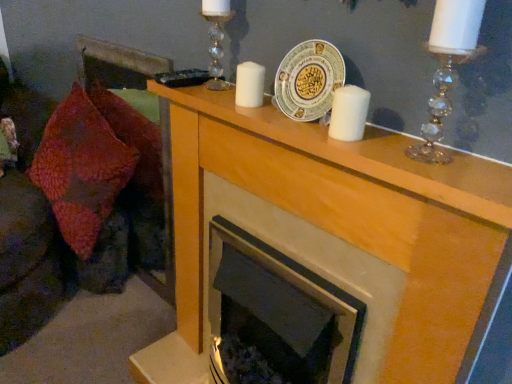
Question: Considering the relative positions of white ceramic plate at center and clear crystal candle holder at upper right, the second candle holder from the back, in the image provided, is white ceramic plate at center to the right of clear crystal candle holder at upper right, the second candle holder from the back, from the viewer's perspective?

Choices:
 (A) yes
 (B) no

Answer: (B)

Question: Does white ceramic plate at center have a lesser width compared to clear crystal candle holder at upper right, which is counted as the 1th candle holder, starting from the front?

Choices:
 (A) no
 (B) yes

Answer: (B)

Question: Can you confirm if white ceramic plate at center is bigger than clear crystal candle holder at upper right, positioned as the second candle holder in left-to-right order?

Choices:
 (A) no
 (B) yes

Answer: (A)

Question: Can clear crystal candle holder at upper right, which is the 1th candle holder in right-to-left order, be found inside white ceramic plate at center?

Choices:
 (A) no
 (B) yes

Answer: (A)

Question: Is white ceramic plate at center next to clear crystal candle holder at upper right, which is counted as the 1th candle holder, starting from the front, and touching it?

Choices:
 (A) no
 (B) yes

Answer: (A)

Question: Is white ceramic plate at center looking in the opposite direction of clear crystal candle holder at upper right, positioned as the second candle holder in left-to-right order?

Choices:
 (A) no
 (B) yes

Answer: (A)

Question: From the image's perspective, would you say white matte candle at center, the first candle ordered from the bottom, is shown under velvet textured throw pillow at left?

Choices:
 (A) no
 (B) yes

Answer: (A)

Question: Is white matte candle at center, the 2th candle positioned from the left, not within velvet textured throw pillow at left?

Choices:
 (A) no
 (B) yes

Answer: (B)

Question: Is white matte candle at center, the 2th candle positioned from the left, not near velvet textured throw pillow at left?

Choices:
 (A) no
 (B) yes

Answer: (B)

Question: Is white matte candle at center, which ranks as the 1th candle in front-to-back order, oriented towards velvet textured throw pillow at left?

Choices:
 (A) no
 (B) yes

Answer: (A)

Question: Is white matte candle at center, positioned as the first candle in right-to-left order, next to velvet textured throw pillow at left?

Choices:
 (A) no
 (B) yes

Answer: (A)

Question: From a real-world perspective, is white matte candle at center, the 2th candle positioned from the left, on top of velvet textured throw pillow at left?

Choices:
 (A) yes
 (B) no

Answer: (A)

Question: Does clear crystal candle holder at upper center, the second candle holder viewed from the front, appear on the left side of white matte candle at center, the 2th candle positioned from the left?

Choices:
 (A) no
 (B) yes

Answer: (B)